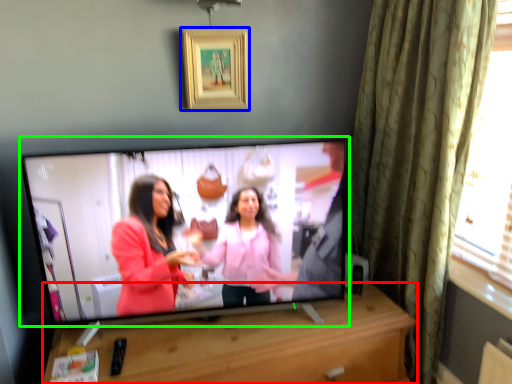
Question: Estimate the real-world distances between objects in this image. Which object is farther from furniture (highlighted by a red box), picture frame (highlighted by a blue box) or television (highlighted by a green box)?

Choices:
 (A) picture frame
 (B) television

Answer: (A)